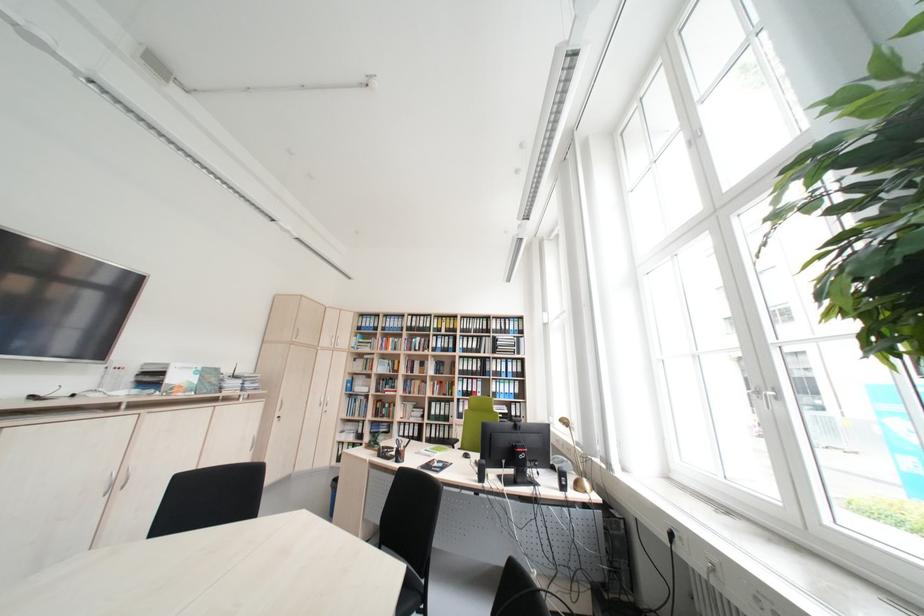
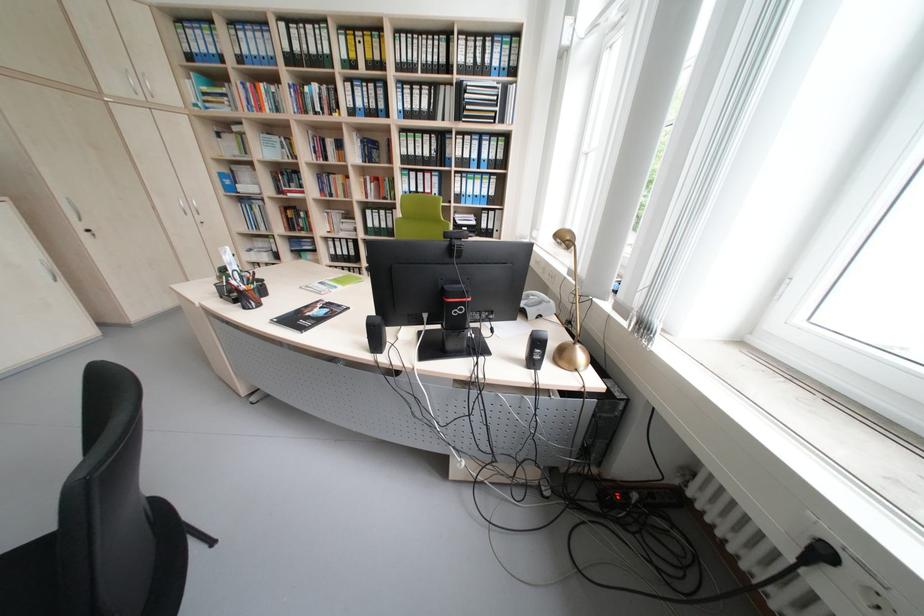
Where in the second image is the point corresponding to (396,363) from the first image?

(286, 140)